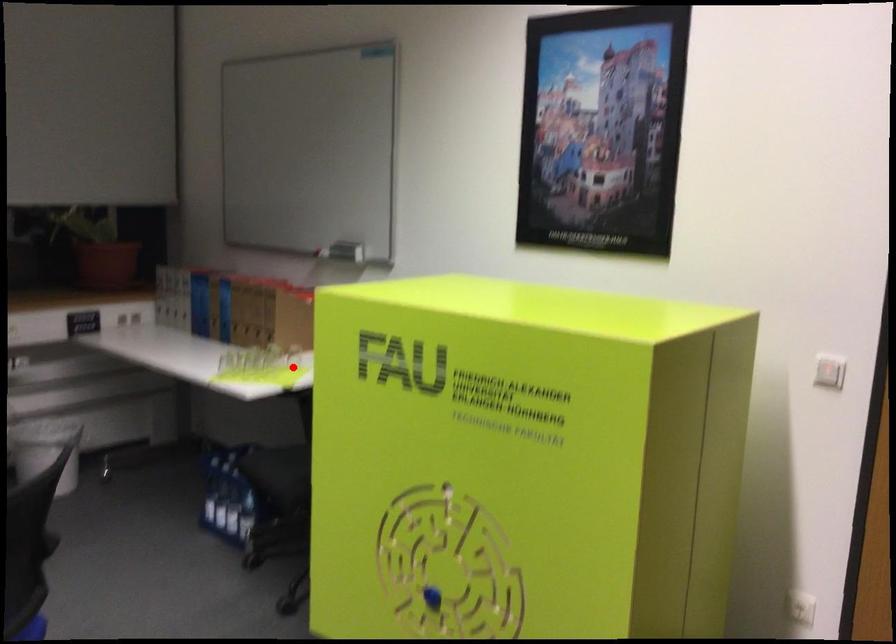
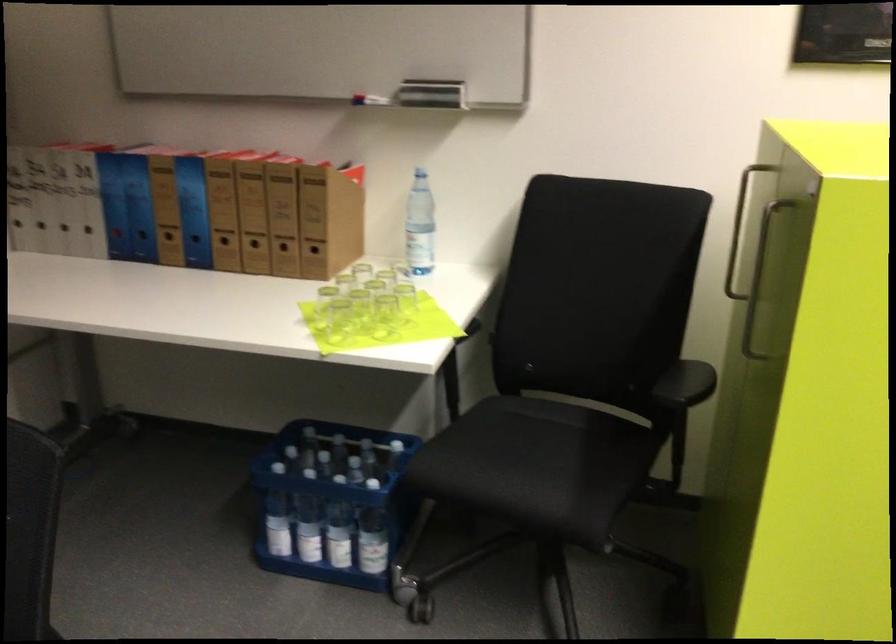
Question: I am providing you with two images of the same scene from different viewpoints. Given a red point in image1, look at the same physical point in image2. Is it:

Choices:
 (A) Closer to the viewpoint
 (B) Farther from the viewpoint

Answer: (A)